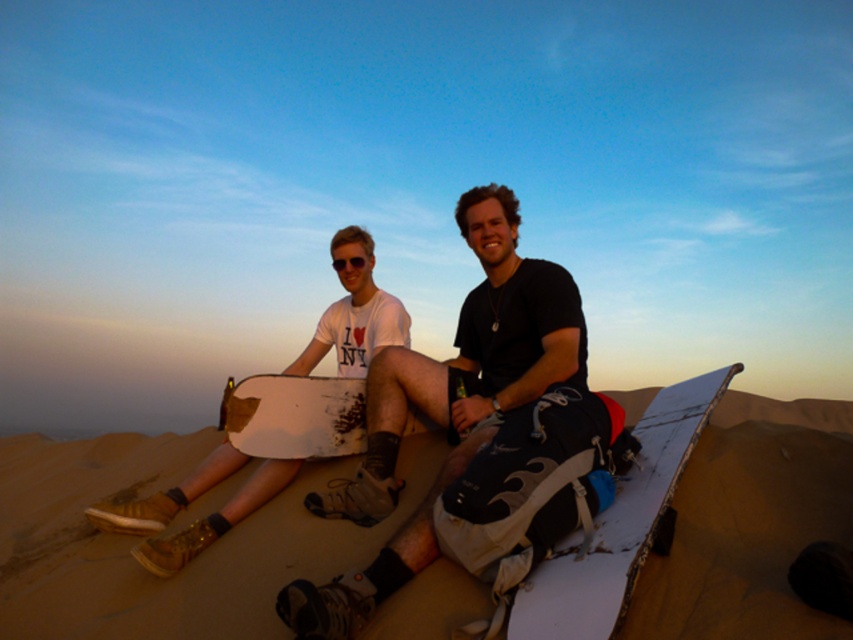
You are planning to place a new object between the brown sandy at center and the white matte snowboard at center. Based on their current positions, where should you place the new object?

The new object should be placed between the brown sandy at center and the white matte snowboard at center, as the brown sandy at center is located below the white matte snowboard at center.